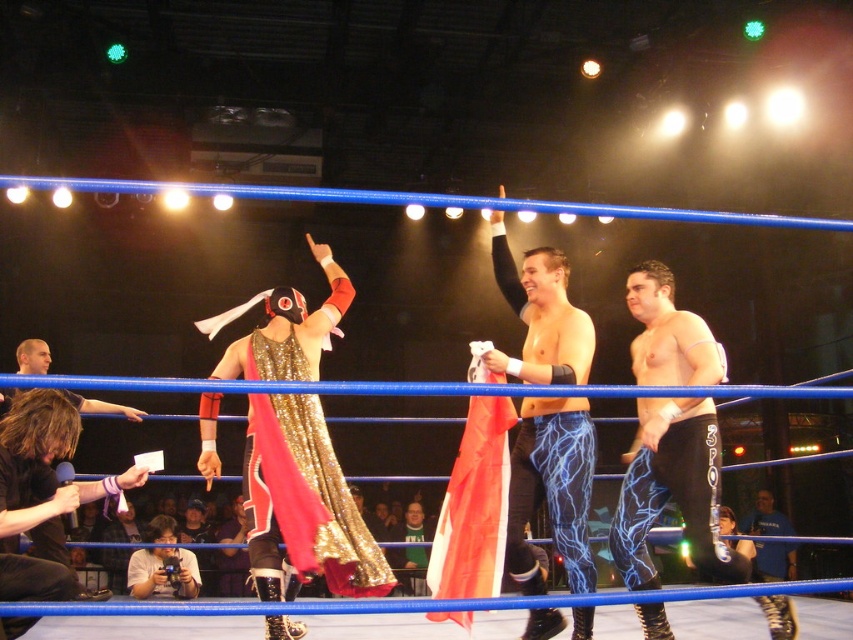
You are a photographer positioned at the back of the arena. You need to capture a clear photo of both the shiny blue leggings at center and the black leather jacket at lower left. Considering their sizes, which object will appear smaller in the photo?

The shiny blue leggings at center will appear smaller in the photo because it is thinner than the black leather jacket at lower left.

You are a photographer in the arena and need to capture a clear shot of the black spandex pants at center and the matte black camera at lower left. Which object is positioned closer to your camera lens?

The black spandex pants at center is closer to the viewer than the matte black camera at lower left, so the black spandex pants at center will appear larger in the photo.